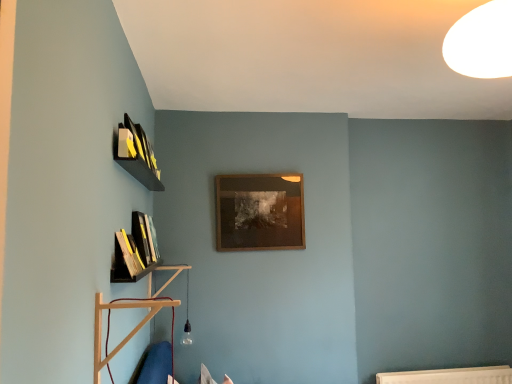
Question: Based on their positions, is wooden picture frame at center located to the left or right of hardcover book at left, marked as the first book in a back-to-front arrangement?

Choices:
 (A) right
 (B) left

Answer: (A)

Question: From a real-world perspective, is wooden picture frame at center positioned above or below hardcover book at left, arranged as the 2th book when viewed from the front?

Choices:
 (A) below
 (B) above

Answer: (B)

Question: Which is nearer to the wooden shelf at lower left, which ranks as the first shelf in front-to-back order?

Choices:
 (A) wooden book at lower left, which is the 2th book from back to front
 (B) wooden picture frame at center
 (C) hardcover book at left, marked as the first book in a back-to-front arrangement
 (D) black matte shelf at left, placed as the 2th shelf when sorted from front to back

Answer: (D)

Question: Which of these objects is positioned closest to the black matte shelf at left, the 1th shelf in the back-to-front sequence?

Choices:
 (A) hardcover book at left, arranged as the 2th book when viewed from the front
 (B) wooden book at lower left, which is counted as the 1th book, starting from the front
 (C) wooden shelf at lower left, which ranks as the first shelf in front-to-back order
 (D) wooden picture frame at center

Answer: (A)